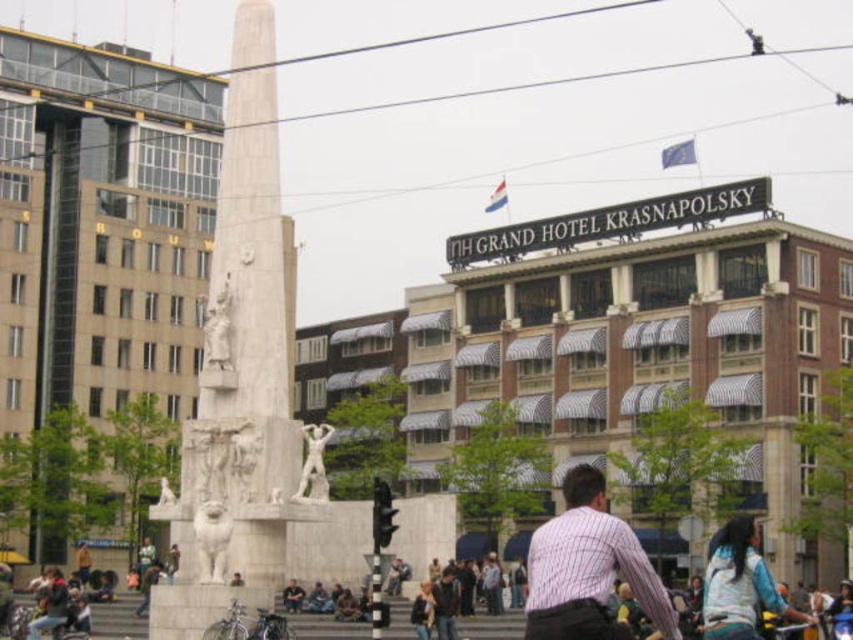
Can you confirm if white marble monument at center is bigger than silver metallic bicycle at lower center?

Yes.

Can you confirm if white marble monument at center is taller than silver metallic bicycle at lower center?

Yes, white marble monument at center is taller than silver metallic bicycle at lower center.

Image resolution: width=853 pixels, height=640 pixels. In order to click on white marble monument at center in this screenshot , I will do `click(239, 372)`.

Which is in front, point (618, 525) or point (317, 445)?

Point (618, 525)

Can you confirm if striped cotton shirt at center is positioned below white marble statue at center?

Correct, striped cotton shirt at center is located below white marble statue at center.

This screenshot has width=853, height=640. Find the location of `striped cotton shirt at center`. striped cotton shirt at center is located at coordinates (589, 566).

You are a GUI agent. You are given a task and a screenshot of the screen. Output one action in this format:
    pyautogui.click(x=<x>, y=<y>)
    Task: Click on the striped cotton shirt at center
    This screenshot has width=853, height=640.
    Given the screenshot: What is the action you would take?
    pos(589,566)

Is point (722, 614) less distant than point (311, 452)?

Yes, point (722, 614) is closer to viewer.

Between point (759, 560) and point (322, 480), which one is positioned behind?

The point (322, 480) is more distant.

Locate an element on the screen. The image size is (853, 640). blue denim jacket at lower right is located at coordinates (740, 584).